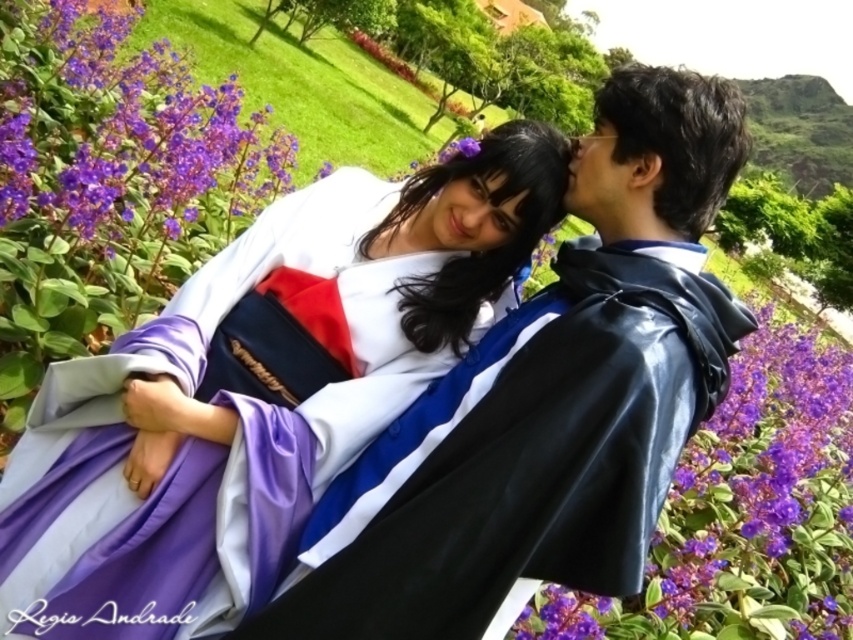
Does satin white kimono at center have a lesser height compared to purple glossy flower at lower right?

No.

In the scene shown: Does satin white kimono at center appear on the left side of purple glossy flower at lower right?

Yes, satin white kimono at center is to the left of purple glossy flower at lower right.

Which is in front, point (181, 401) or point (750, 579)?

Point (181, 401)

The height and width of the screenshot is (640, 853). I want to click on satin white kimono at center, so click(x=259, y=387).

What do you see at coordinates (259, 387) in the screenshot? This screenshot has height=640, width=853. I see `satin white kimono at center` at bounding box center [259, 387].

Who is taller, satin white kimono at center or purple matte flowers at upper left?

With more height is purple matte flowers at upper left.

Describe the element at coordinates (259, 387) in the screenshot. The width and height of the screenshot is (853, 640). I see `satin white kimono at center` at that location.

You are a GUI agent. You are given a task and a screenshot of the screen. Output one action in this format:
    pyautogui.click(x=<x>, y=<y>)
    Task: Click on the satin white kimono at center
    
    Given the screenshot: What is the action you would take?
    pyautogui.click(x=259, y=387)

From the picture: Is shiny black cape at center bigger than purple matte flowers at upper left?

Incorrect, shiny black cape at center is not larger than purple matte flowers at upper left.

Describe the element at coordinates (523, 454) in the screenshot. I see `shiny black cape at center` at that location.

Is point (351, 589) positioned after point (28, 16)?

No, (351, 589) is in front of (28, 16).

This screenshot has width=853, height=640. In order to click on shiny black cape at center in this screenshot , I will do `click(523, 454)`.